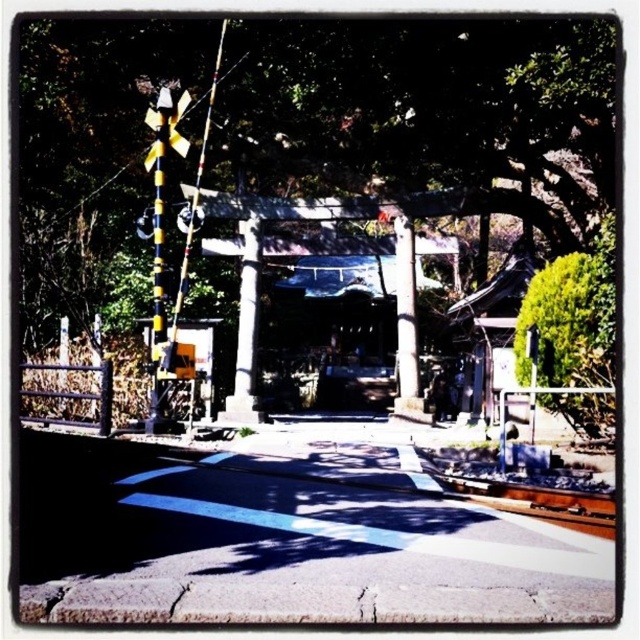
In the scene shown: Is white stone pillar at center closer to the viewer compared to yellow/black striped traffic light at upper left?

No, white stone pillar at center is further to the viewer.

Identify the location of white stone pillar at center. (246, 330).

Is white glossy pole at center below yellow/black striped traffic light at upper left?

Yes.

Who is taller, white glossy pole at center or yellow/black striped traffic light at upper left?

Standing taller between the two is yellow/black striped traffic light at upper left.

Is point (401, 308) more distant than point (179, 100)?

Yes, point (401, 308) is farther from viewer.

Identify the location of white glossy pole at center. (404, 314).

Can you confirm if green leafy tree at upper center is positioned above white glossy pole at center?

Indeed, green leafy tree at upper center is positioned over white glossy pole at center.

Which is more to the right, green leafy tree at upper center or white glossy pole at center?

white glossy pole at center is more to the right.

Who is more distant from viewer, (355, 163) or (412, 284)?

The point (355, 163) is more distant.

Locate an element on the screen. green leafy tree at upper center is located at coordinates (308, 180).